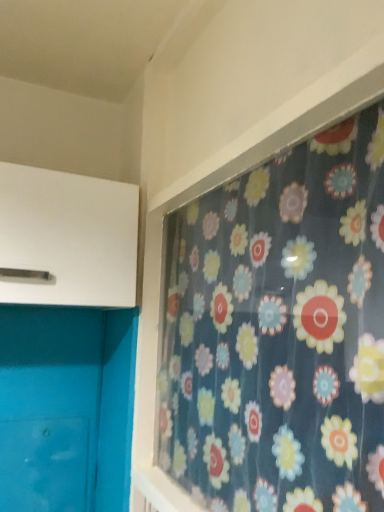
What do you see at coordinates (279, 331) in the screenshot? This screenshot has width=384, height=512. I see `floral fabric curtain at upper right` at bounding box center [279, 331].

Based on the photo, what is the approximate height of floral fabric curtain at upper right?

27.33 inches.

In order to face floral fabric curtain at upper right, should I rotate leftwards or rightwards?

You should rotate right by 6.426 degrees.

You are a GUI agent. You are given a task and a screenshot of the screen. Output one action in this format:
    pyautogui.click(x=<x>, y=<y>)
    Task: Click on the floral fabric curtain at upper right
    The image size is (384, 512).
    Given the screenshot: What is the action you would take?
    pyautogui.click(x=279, y=331)

The image size is (384, 512). Identify the location of floral fabric curtain at upper right. pos(279,331).